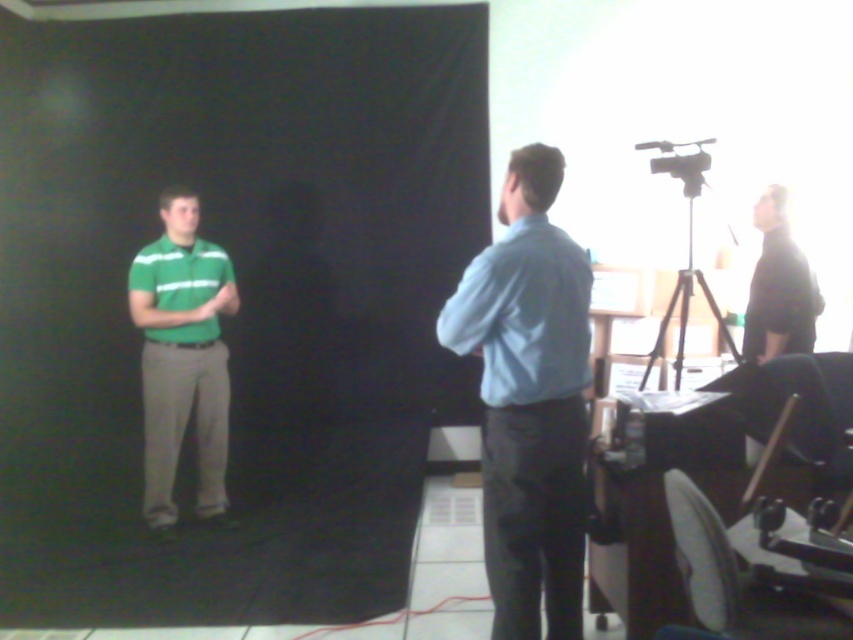
You are a photographer setting up for a shoot. You have a green matte shirt at left and a black matte tripod at right. Which object is closer to the camera?

The green matte shirt at left is closer to the camera since it is positioned on the left side of the black matte tripod at right.

You are setting up a photo shoot and need to ensure that the green matte polo shirt at left and the black matte tripod at right are visible in the frame. Based on their sizes, which object would you adjust first to make sure both fit comfortably within the camera view?

The green matte polo shirt at left occupies less space than the black matte tripod at right, so you should adjust the position of the black matte tripod at right first since it is larger and may require more space to fit comfortably within the camera view.